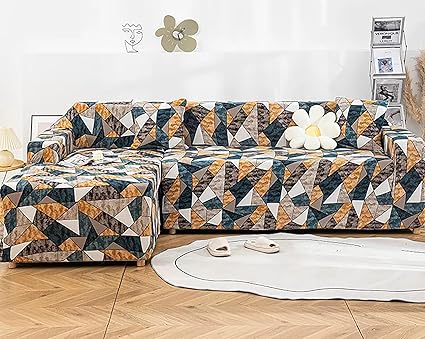
Find the location of a particular element. The height and width of the screenshot is (339, 425). ottoman front legs is located at coordinates (x=140, y=262), (x=13, y=265).